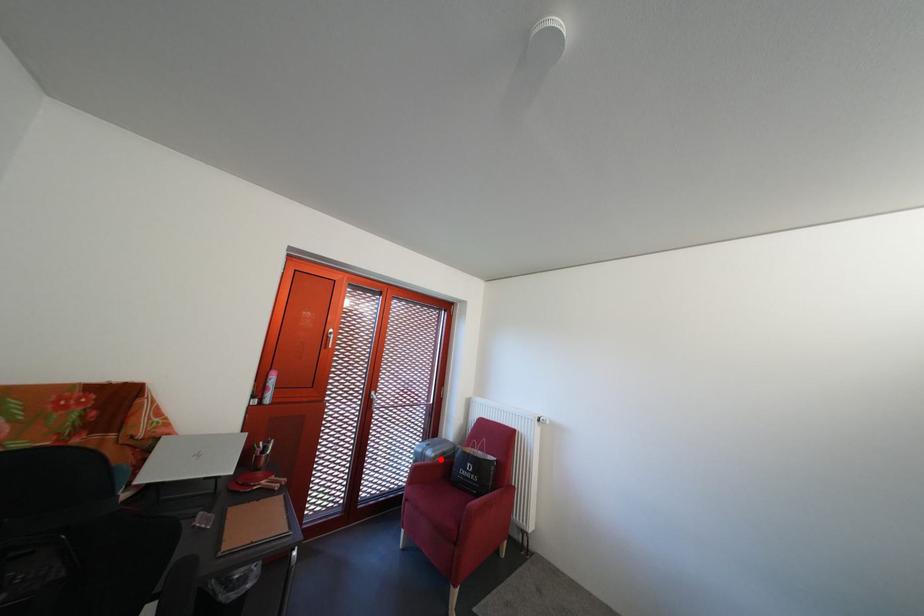
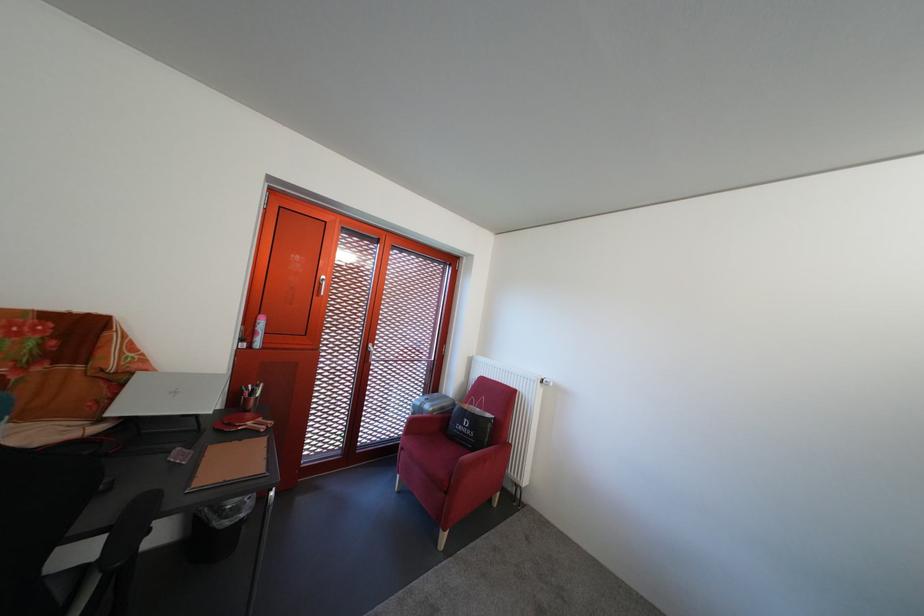
Locate, in the second image, the point that corresponds to the highlighted location in the first image.

(439, 413)